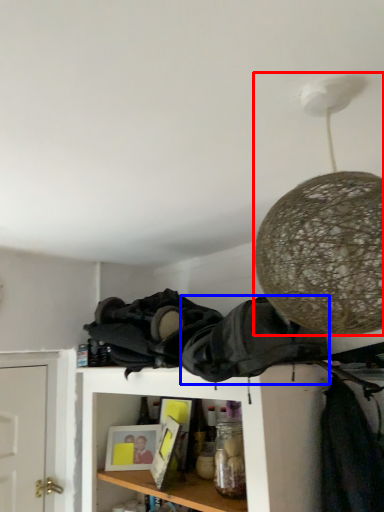
Question: Among these objects, which one is nearest to the camera, lamp (highlighted by a red box) or clothing (highlighted by a blue box)?

Choices:
 (A) lamp
 (B) clothing

Answer: (A)